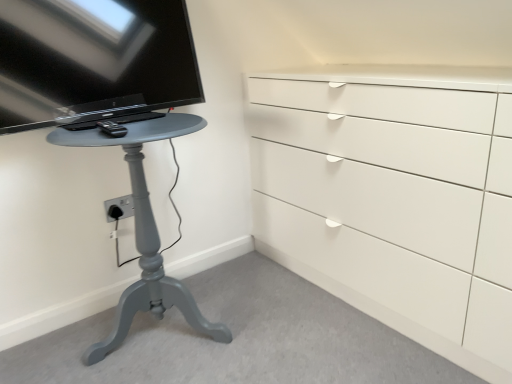
Identify the location of vacant space underneath matte gray table at left (from a real-world perspective). This screenshot has width=512, height=384. (161, 331).